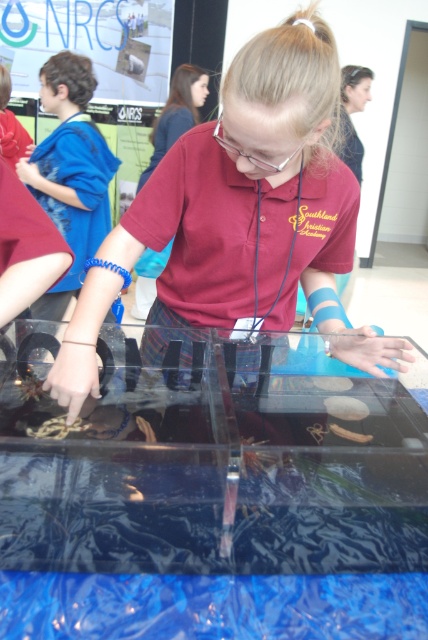
The girl is wearing a blue fabric wristband at upper left and has clear plastic goggles at center. Which item is taller?

The blue fabric wristband at upper left is taller than the clear plastic goggles at center.

What is located at the coordinates point (240,216)?

A matte plastic container at center is located at point (240,216).